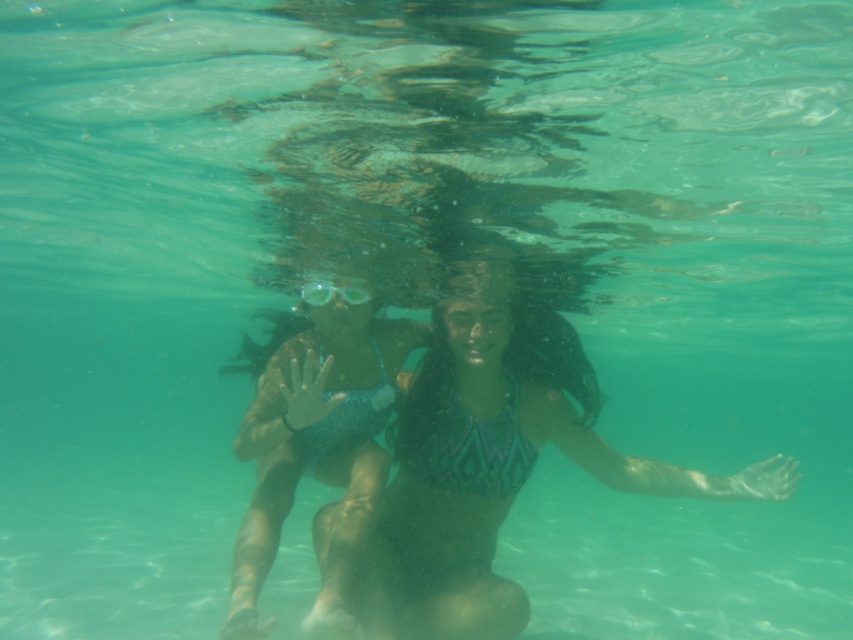
You are a snorkeler preparing to dive into the turquoise water. You have the green textured bikini top at center and the clear plastic goggles at center. Which item should you put on first to ensure proper fitting?

You should put on the clear plastic goggles at center first because the green textured bikini top at center is bigger and can be worn over the goggles without interfering with their fit.